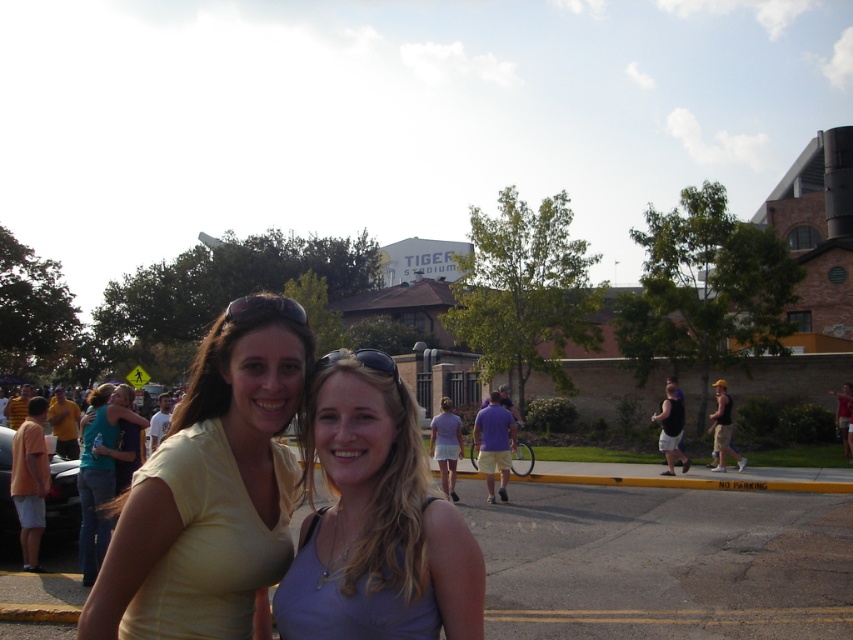
You are a photographer trying to capture the two women in the scene. The yellow matte shirt at center and the purple matte tank top at center are both in your viewfinder. According to the scene, which clothing item is positioned higher in the frame?

The yellow matte shirt at center is above the purple matte tank top at center, so it is positioned higher in the frame.

You are standing in the middle of the street and want to walk towards both the point at coordinates (252, 592) and the point at (351, 372). Which point will you reach first?

You will reach the point at coordinates (252, 592) first because it is closer to you than the point at (351, 372).

You are a photographer trying to capture a photo of both the yellow matte shirt at center and the purple matte tank top at center. Since you want both subjects to be clearly visible, which one should you focus on first to ensure the other remains in focus?

You should focus on the yellow matte shirt at center first because it is closer to the viewer than the purple matte tank top at center. By focusing on the closer subject, the farther one will still be in focus due to the depth of field.